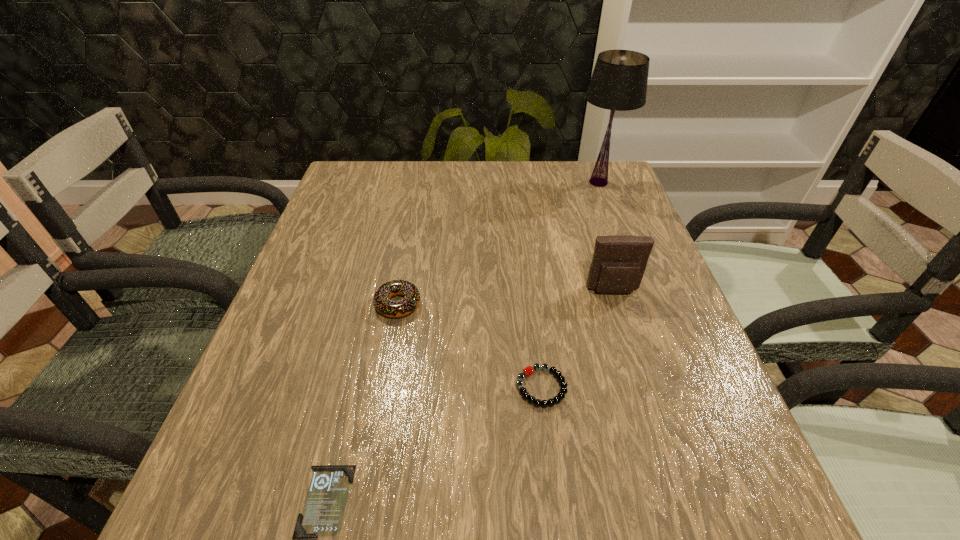
This screenshot has width=960, height=540. Identify the location of free space between the shortest object and the doughnut. (362, 402).

At what (x,y) coordinates should I click in order to perform the action: click on vacant space that is in between the tallest object and the nearest object. Please return your answer as a coordinate pair (x, y). This screenshot has width=960, height=540. Looking at the image, I should click on (462, 341).

This screenshot has height=540, width=960. What are the coordinates of `vacant area between the fourth shortest object and the third tallest object` in the screenshot? It's located at (506, 298).

Identify the location of vacant space that is in between the third object from right to left and the identity card. (434, 444).

The height and width of the screenshot is (540, 960). Identify the location of free space between the fourth farthest object and the pouch. (577, 339).

In order to click on blank region between the doughnut and the bracelet in this screenshot , I will do click(469, 346).

Locate an element on the screen. vacant space in between the identity card and the fourth farthest object is located at coordinates (434, 444).

Locate an element on the screen. The width and height of the screenshot is (960, 540). free space between the lampshade and the second nearest object is located at coordinates (569, 285).

Select which object appears as the second closest to the pouch. Please provide its 2D coordinates. Your answer should be formatted as a tuple, i.e. [(x, y)], where the tuple contains the x and y coordinates of a point satisfying the conditions above.

[(619, 81)]

Identify the location of object that ranks as the second closest to the doughnut. The height and width of the screenshot is (540, 960). (322, 515).